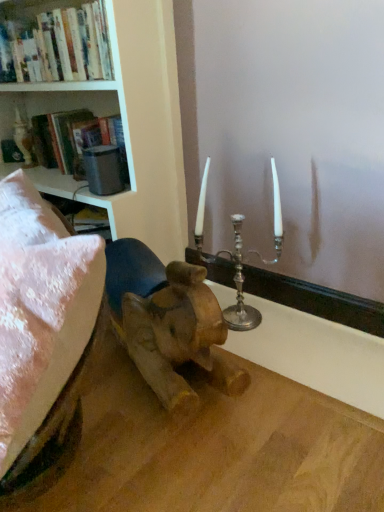
What is the approximate width of matte black bookshelf at upper left?

matte black bookshelf at upper left is 23.18 centimeters wide.

The height and width of the screenshot is (512, 384). What do you see at coordinates (233, 262) in the screenshot? I see `silver metallic candle holder at center` at bounding box center [233, 262].

Measure the distance between point (227, 279) and camera.

A distance of 5.55 feet exists between point (227, 279) and camera.

What do you see at coordinates (90, 86) in the screenshot?
I see `white painted wood bookcase at upper left` at bounding box center [90, 86].

I want to click on matte black bookshelf at upper left, so click(64, 105).

Who is smaller, hardcover books at upper left or white painted wood bookcase at upper left?

hardcover books at upper left is smaller.

Relative to white painted wood bookcase at upper left, is hardcover books at upper left in front or behind?

In the image, hardcover books at upper left appears behind white painted wood bookcase at upper left.

Is hardcover books at upper left next to white painted wood bookcase at upper left and touching it?

No, hardcover books at upper left is not next to white painted wood bookcase at upper left.

From the image's perspective, does hardcover books at upper left appear lower than white painted wood bookcase at upper left?

Actually, hardcover books at upper left appears above white painted wood bookcase at upper left in the image.

Is white painted wood bookcase at upper left shorter than silver metallic candlestick at upper center?

Incorrect, the height of white painted wood bookcase at upper left does not fall short of that of silver metallic candlestick at upper center.

Considering their positions, is white painted wood bookcase at upper left located in front of or behind silver metallic candlestick at upper center?

In the image, white painted wood bookcase at upper left appears in front of silver metallic candlestick at upper center.

Is white painted wood bookcase at upper left not near silver metallic candlestick at upper center?

That's not correct — white painted wood bookcase at upper left is a little close to silver metallic candlestick at upper center.

Considering the relative sizes of white painted wood bookcase at upper left and matte black bookshelf at upper left in the image provided, is white painted wood bookcase at upper left taller than matte black bookshelf at upper left?

Yes.

From the image's perspective, is white painted wood bookcase at upper left beneath matte black bookshelf at upper left?

Actually, white painted wood bookcase at upper left appears above matte black bookshelf at upper left in the image.

Is point (39, 83) farther from camera compared to point (51, 91)?

Yes, it is.

Is white painted wood bookcase at upper left not within matte black bookshelf at upper left?

Yes, white painted wood bookcase at upper left is outside of matte black bookshelf at upper left.

From the image's perspective, which one is positioned higher, matte black bookshelf at upper left or hardcover books at upper left?

hardcover books at upper left is shown above in the image.

This screenshot has height=512, width=384. I want to click on shelf that appears below the hardcover books at upper left (from a real-world perspective), so click(x=64, y=105).

Is matte black bookshelf at upper left aimed at hardcover books at upper left?

No, matte black bookshelf at upper left does not turn towards hardcover books at upper left.

Can you confirm if matte black bookshelf at upper left is shorter than hardcover books at upper left?

Yes, matte black bookshelf at upper left is shorter than hardcover books at upper left.

Based on the photo, from a real-world perspective, which is physically above, hardcover books at upper left or matte black bookshelf at upper left?

In real-world perspective, hardcover books at upper left is above.

From the image's perspective, who appears lower, hardcover books at upper left or matte black bookshelf at upper left?

matte black bookshelf at upper left, from the image's perspective.

Identify the location of book that is above the matte black bookshelf at upper left (from a real-world perspective). The height and width of the screenshot is (512, 384). (54, 42).

From their relative heights in the image, would you say hardcover books at upper left is taller or shorter than matte black bookshelf at upper left?

In the image, hardcover books at upper left appears to be taller than matte black bookshelf at upper left.

Based on the photo, is silver metallic candle holder at center positioned beyond the bounds of hardcover books at upper left?

Yes, silver metallic candle holder at center is not within hardcover books at upper left.

Where is `book lying on the left of silver metallic candle holder at center`? book lying on the left of silver metallic candle holder at center is located at coordinates click(54, 42).

Consider the image. From the image's perspective, does silver metallic candle holder at center appear higher than hardcover books at upper left?

No.

From a real-world perspective, is silver metallic candle holder at center located higher than silver metallic candlestick at upper center?

Yes, from a real-world perspective, silver metallic candle holder at center is over silver metallic candlestick at upper center

Who is shorter, silver metallic candle holder at center or silver metallic candlestick at upper center?

silver metallic candlestick at upper center.

From the image's perspective, does silver metallic candle holder at center appear lower than silver metallic candlestick at upper center?

Actually, silver metallic candle holder at center appears above silver metallic candlestick at upper center in the image.

The height and width of the screenshot is (512, 384). I want to click on candle holder located above the silver metallic candlestick at upper center (from a real-world perspective), so click(233, 262).

The height and width of the screenshot is (512, 384). I want to click on book located above the white painted wood bookcase at upper left (from a real-world perspective), so click(x=54, y=42).

The width and height of the screenshot is (384, 512). I want to click on window sill that appears below the white painted wood bookcase at upper left (from a real-world perspective), so click(x=316, y=300).

Based on their spatial positions, is white painted wood bookcase at upper left or silver metallic candlestick at upper center further from hardcover books at upper left?

silver metallic candlestick at upper center lies further to hardcover books at upper left than the other object.

Looking at the image, which one is located closer to matte black bookshelf at upper left, white painted wood bookcase at upper left or silver metallic candlestick at upper center?

white painted wood bookcase at upper left is closer to matte black bookshelf at upper left.

Considering their positions, is white painted wood bookcase at upper left positioned closer to matte black bookshelf at upper left than silver metallic candle holder at center?

white painted wood bookcase at upper left.

Looking at the image, which one is located closer to hardcover books at upper left, silver metallic candlestick at upper center or silver metallic candle holder at center?

silver metallic candle holder at center.

Which object lies nearer to the anchor point matte black bookshelf at upper left, silver metallic candle holder at center or silver metallic candlestick at upper center?

silver metallic candle holder at center is closer to matte black bookshelf at upper left.

Based on their spatial positions, is matte black bookshelf at upper left or silver metallic candlestick at upper center closer to silver metallic candle holder at center?

silver metallic candlestick at upper center.

Based on their spatial positions, is silver metallic candlestick at upper center or hardcover books at upper left further from silver metallic candle holder at center?

The object further to silver metallic candle holder at center is hardcover books at upper left.

From the image, which object appears to be farther from silver metallic candle holder at center, white painted wood bookcase at upper left or matte black bookshelf at upper left?

matte black bookshelf at upper left lies further to silver metallic candle holder at center than the other object.

Identify the location of bookcase between hardcover books at upper left and matte black bookshelf at upper left in the vertical direction. The height and width of the screenshot is (512, 384). (90, 86).

Locate an element on the screen. Image resolution: width=384 pixels, height=512 pixels. candle holder situated between white painted wood bookcase at upper left and silver metallic candlestick at upper center from left to right is located at coordinates (233, 262).

The image size is (384, 512). I want to click on candle holder between matte black bookshelf at upper left and silver metallic candlestick at upper center in the horizontal direction, so click(233, 262).

Where is `shelf between hardcover books at upper left and silver metallic candle holder at center vertically`? shelf between hardcover books at upper left and silver metallic candle holder at center vertically is located at coordinates (64, 105).